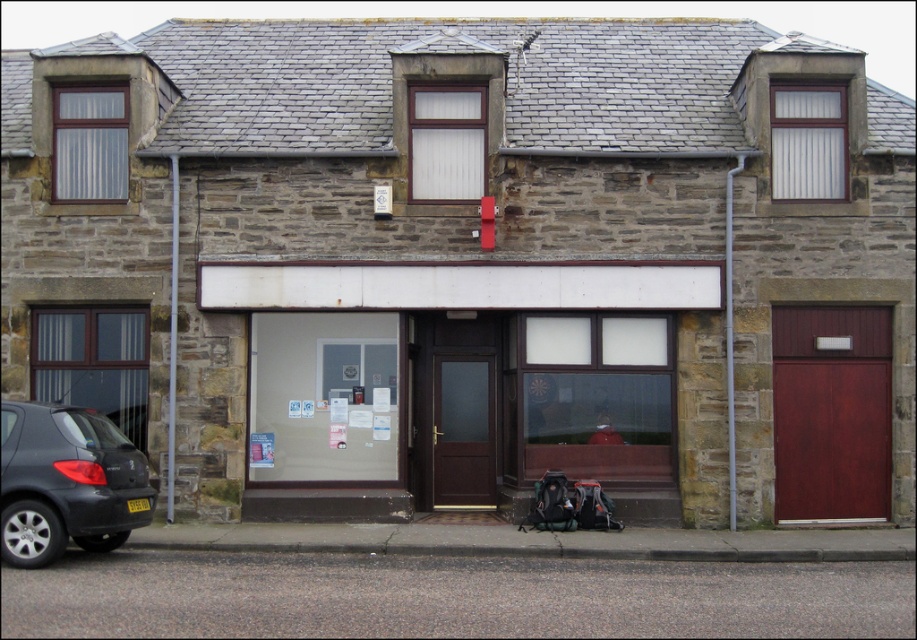
Question: Which point appears closest to the camera in this image?

Choices:
 (A) (772, 355)
 (B) (440, 474)
 (C) (10, 509)

Answer: (C)

Question: Is matte black car at lower left positioned before dark brown wood door at center?

Choices:
 (A) yes
 (B) no

Answer: (A)

Question: Does dark red wood door at right appear under dark brown wood door at center?

Choices:
 (A) yes
 (B) no

Answer: (B)

Question: Estimate the real-world distances between objects in this image. Which object is farther from the matte black car at lower left?

Choices:
 (A) dark red wood door at right
 (B) dark brown wood door at center

Answer: (A)

Question: Based on their relative distances, which object is nearer to the dark brown wood door at center?

Choices:
 (A) dark red wood door at right
 (B) matte black car at lower left

Answer: (A)

Question: Is matte black car at lower left thinner than dark brown wood door at center?

Choices:
 (A) yes
 (B) no

Answer: (B)